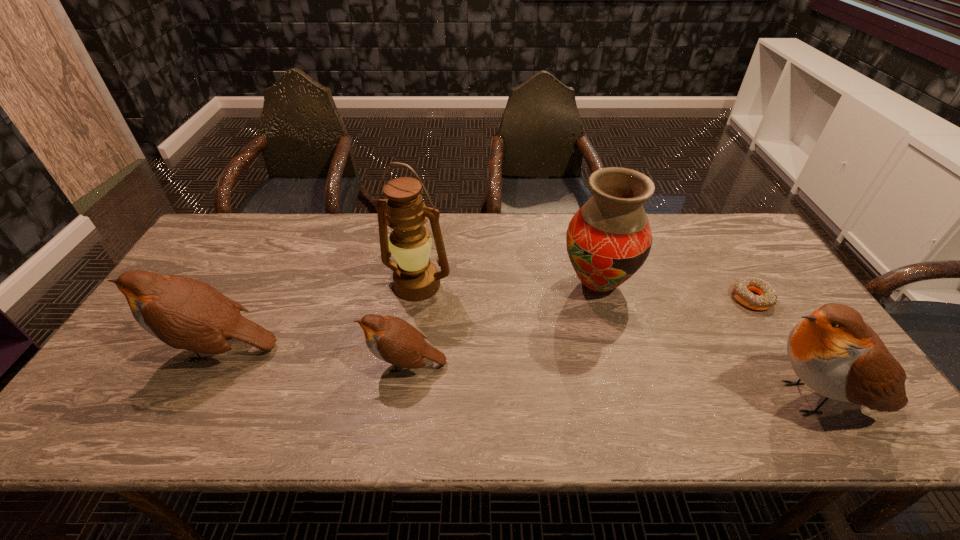
The image size is (960, 540). What are the coordinates of `the second shortest bird` in the screenshot? It's located at (184, 313).

Locate an element on the screen. The height and width of the screenshot is (540, 960). the leftmost bird is located at coordinates (184, 313).

Locate an element on the screen. the shortest bird is located at coordinates (393, 340).

You are a GUI agent. You are given a task and a screenshot of the screen. Output one action in this format:
    pyautogui.click(x=<x>, y=<y>)
    Task: Click on the second shortest object
    The image size is (960, 540).
    Given the screenshot: What is the action you would take?
    point(393,340)

What are the coordinates of `the rightmost bird` in the screenshot? It's located at (833, 351).

At what (x,y) coordinates should I click in order to perform the action: click on vase. Please return your answer as a coordinate pair (x, y). Looking at the image, I should click on (608, 239).

Find the location of `the shortest object`. the shortest object is located at coordinates (741, 290).

Where is `oil lamp`? The width and height of the screenshot is (960, 540). oil lamp is located at coordinates (415, 278).

Image resolution: width=960 pixels, height=540 pixels. Find the location of `vacant space located 0.080m at the face of the leftmost bird`. vacant space located 0.080m at the face of the leftmost bird is located at coordinates (127, 348).

You are a GUI agent. You are given a task and a screenshot of the screen. Output one action in this format:
    pyautogui.click(x=<x>, y=<y>)
    Task: Click on the free space located 0.070m at the face of the leftmost bird
    
    Given the screenshot: What is the action you would take?
    [x=132, y=348]